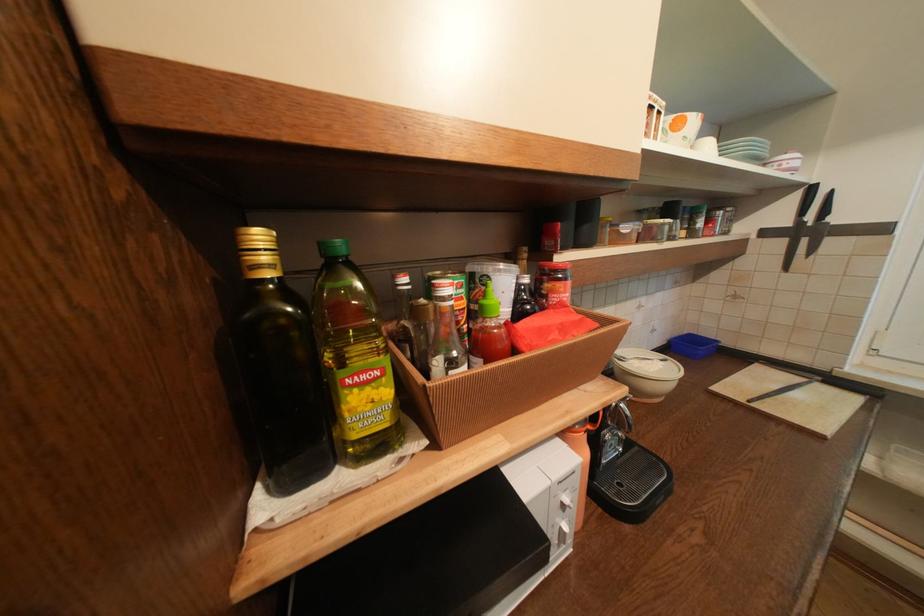
Where would you lift the striped ceramic bowl? Please return your answer as a coordinate pair (x, y).

(646, 373)